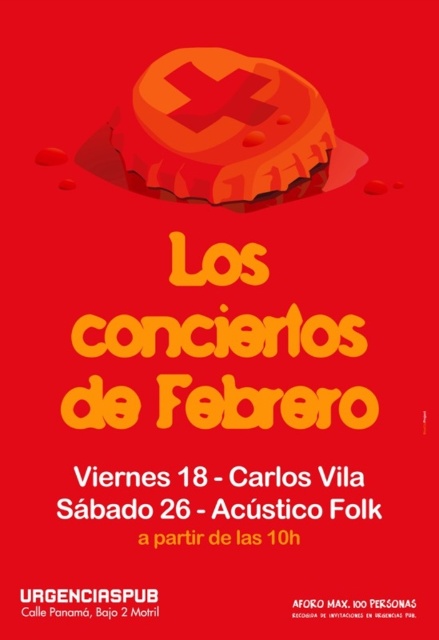
You are designing a poster and want to ensure that the matte plastic bottle cap at upper center and the white paper text at center are visually balanced. Given their sizes, which element should you adjust to achieve this balance?

The matte plastic bottle cap at upper center is larger than the white paper text at center. To achieve visual balance, you should either reduce the size of the matte plastic bottle cap at upper center or increase the size of the white paper text at center.